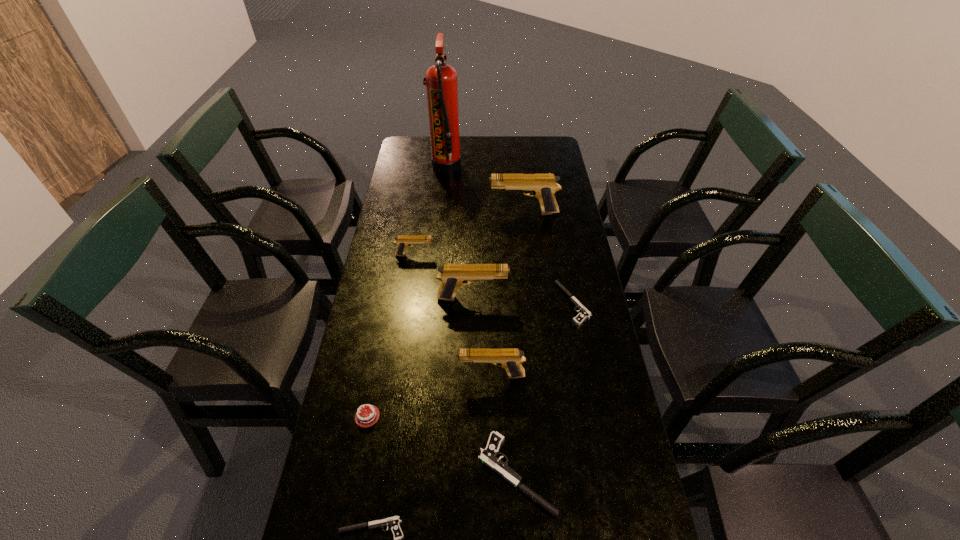
Identify the location of vacant area at the far left corner. (406, 151).

I want to click on free point between the eighth shortest object and the second biggest black pistol, so click(548, 258).

Where is `unoccupied area between the tallest pistol and the fifth farthest pistol`? The width and height of the screenshot is (960, 540). unoccupied area between the tallest pistol and the fifth farthest pistol is located at coordinates (508, 294).

Identify the location of free space between the tallest pistol and the second shortest object. Image resolution: width=960 pixels, height=540 pixels. (548, 258).

The height and width of the screenshot is (540, 960). What are the coordinates of `free spot between the third smallest tan pistol and the fourth tallest object` in the screenshot? It's located at (482, 336).

Find the location of a particular element. The width and height of the screenshot is (960, 540). vacant space in between the red chocolate cake and the third shortest pistol is located at coordinates (442, 445).

Find the location of a particular element. object that can be found as the second closest to the smallest black pistol is located at coordinates (489, 455).

Locate an element on the screen. Image resolution: width=960 pixels, height=540 pixels. object that is the third closest to the rightmost black pistol is located at coordinates (489, 455).

This screenshot has height=540, width=960. I want to click on pistol that is the seventh closest to the red chocolate cake, so click(x=543, y=186).

Find the location of `the fourth closest pistol to the smallest black pistol`. the fourth closest pistol to the smallest black pistol is located at coordinates (584, 314).